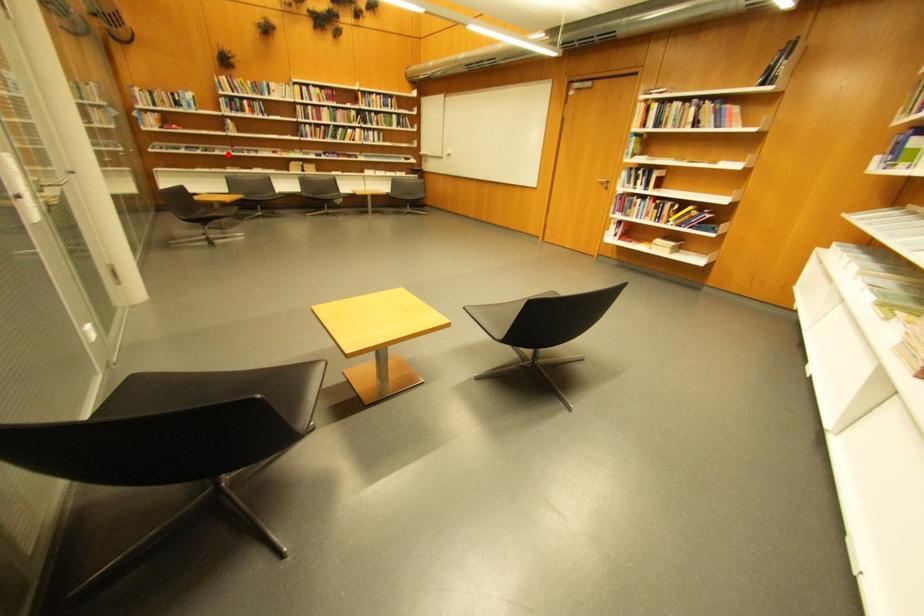
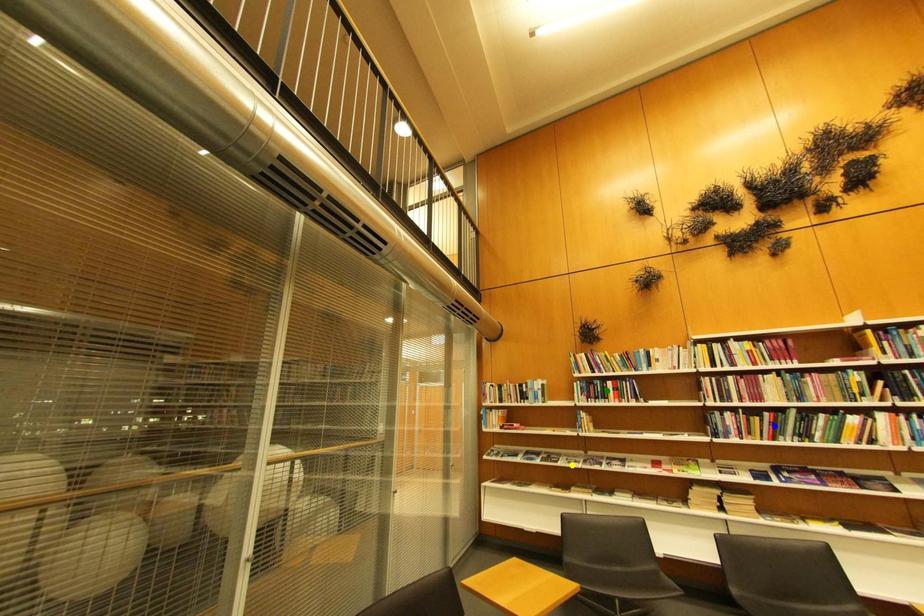
Question: I am providing you with two images of the same scene from different viewpoints. A red point is marked on the first image. You are given multiple points on the second image. Which mark in image 2 goes with the point in image 1?

Choices:
 (A) green point
 (B) blue point
 (C) yellow point

Answer: (C)